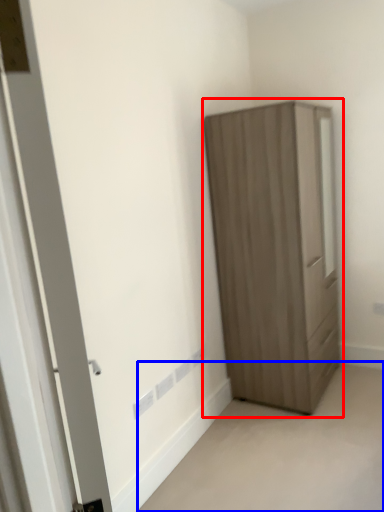
Question: Among these objects, which one is farthest to the camera, cupboard (highlighted by a red box) or corridor (highlighted by a blue box)?

Choices:
 (A) cupboard
 (B) corridor

Answer: (A)